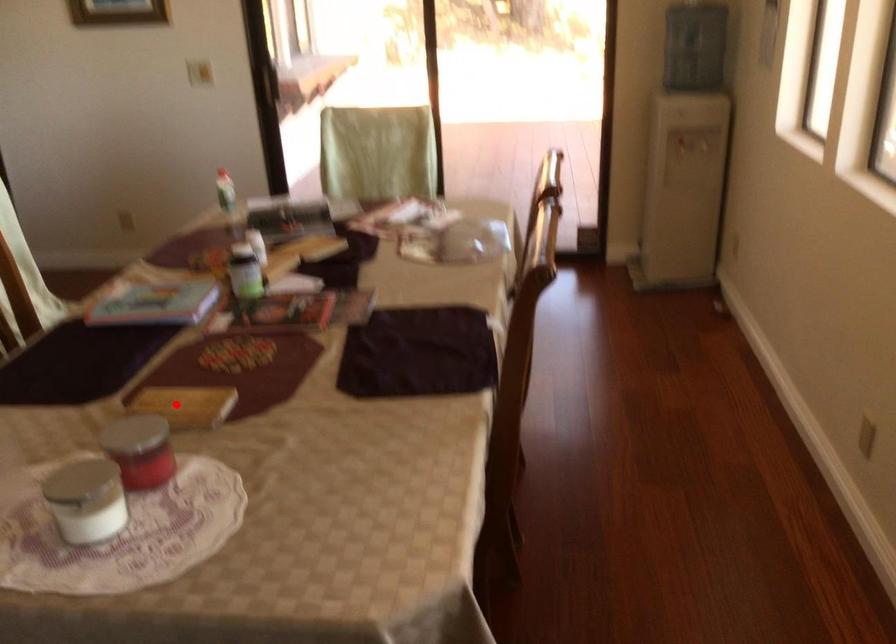
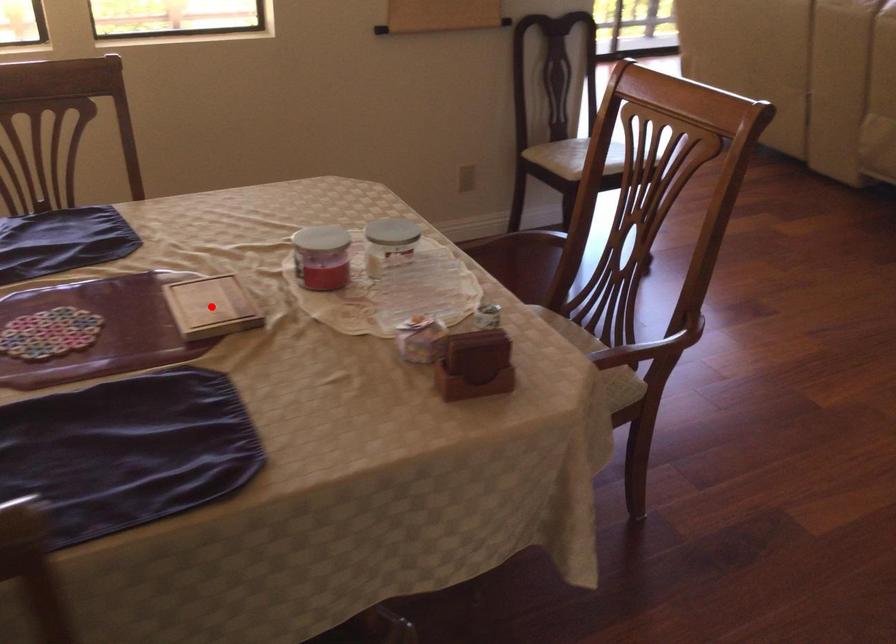
I am providing you with two images of the same scene from different viewpoints. A red point is marked on the first image and another point is marked on the second image. Does the point marked in image1 correspond to the same location as the one in image2?

Yes